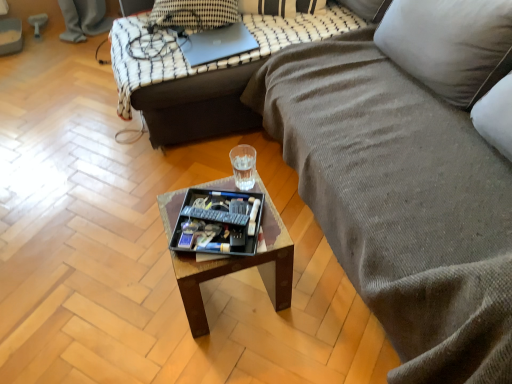
In order to click on free space above black plastic tray at center (from a real-world perspective) in this screenshot , I will do `click(218, 220)`.